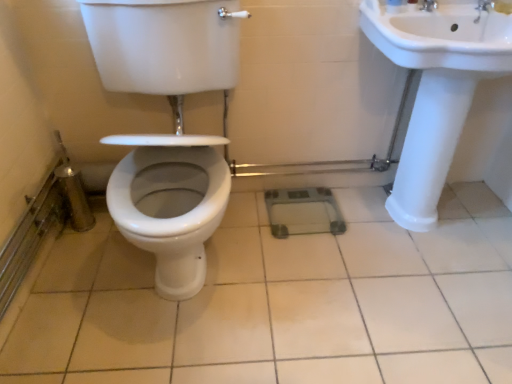
This screenshot has height=384, width=512. Identify the location of free spot in front of white glossy sink at right. (425, 305).